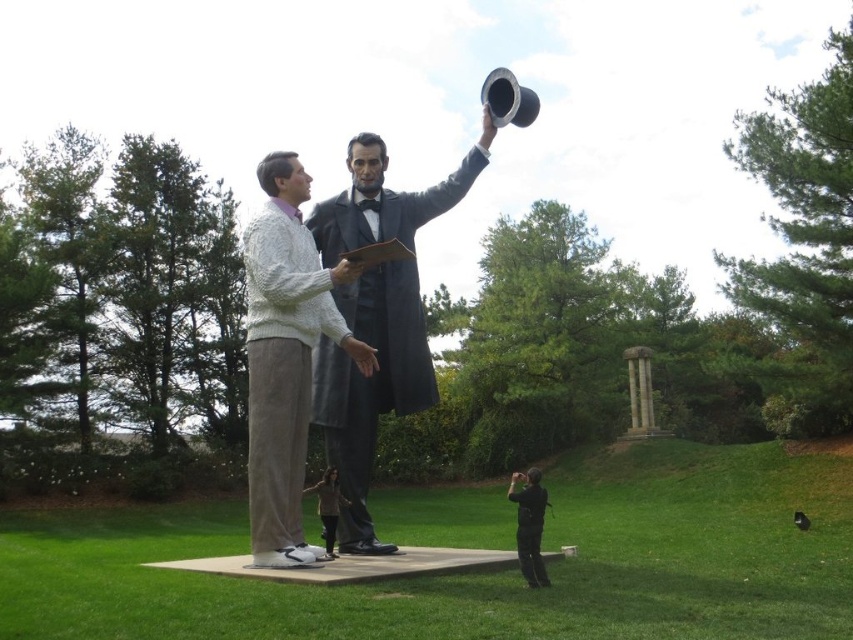
How much distance is there between smooth gray suit at center and white knitted sweater at center?

smooth gray suit at center is 4.04 feet from white knitted sweater at center.

Can you confirm if smooth gray suit at center is wider than white knitted sweater at center?

No, smooth gray suit at center is not wider than white knitted sweater at center.

Locate an element on the screen. smooth gray suit at center is located at coordinates (370, 387).

Is smooth gray suit at center to the left of brown fabric jacket at lower center from the viewer's perspective?

No, smooth gray suit at center is not to the left of brown fabric jacket at lower center.

Is point (345, 534) farther from camera compared to point (335, 502)?

Yes, it is.

The image size is (853, 640). I want to click on smooth gray suit at center, so click(370, 387).

Is point (257, 291) closer to viewer compared to point (335, 500)?

Yes, it is.

Is white knitted sweater at center closer to camera compared to brown fabric jacket at lower center?

Yes, it is in front of brown fabric jacket at lower center.

Does point (250, 506) come in front of point (322, 525)?

That is True.

This screenshot has width=853, height=640. In order to click on white knitted sweater at center in this screenshot , I will do `click(285, 356)`.